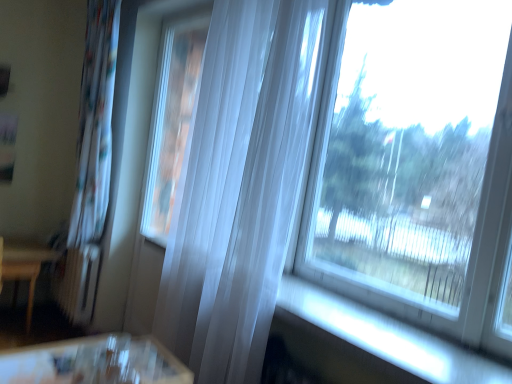
Question: From a real-world perspective, is transparent glass window at upper right positioned over white sheer curtain at left, the 2th curtain positioned from the right, based on gravity?

Choices:
 (A) no
 (B) yes

Answer: (B)

Question: Does transparent glass window at upper right have a lesser width compared to white sheer curtain at left, placed as the first curtain when sorted from left to right?

Choices:
 (A) no
 (B) yes

Answer: (B)

Question: Is white sheer curtain at left, the first curtain in the back-to-front sequence, at the back of transparent glass window at upper right?

Choices:
 (A) yes
 (B) no

Answer: (B)

Question: Does transparent glass window at upper right turn towards white sheer curtain at left, the 2th curtain positioned from the right?

Choices:
 (A) yes
 (B) no

Answer: (B)

Question: Can you confirm if transparent glass window at upper right is shorter than white sheer curtain at left, the 2th curtain positioned from the right?

Choices:
 (A) no
 (B) yes

Answer: (B)

Question: Based on their positions, is white sheer curtain at left, which is the 2th curtain in front-to-back order, located to the left or right of translucent white curtain at center, the first curtain viewed from the right?

Choices:
 (A) right
 (B) left

Answer: (B)

Question: In terms of height, does white sheer curtain at left, which is the 2th curtain in front-to-back order, look taller or shorter compared to translucent white curtain at center, the first curtain viewed from the right?

Choices:
 (A) tall
 (B) short

Answer: (A)

Question: Looking at their shapes, would you say white sheer curtain at left, the 2th curtain positioned from the right, is wider or thinner than translucent white curtain at center, which appears as the second curtain when viewed from the back?

Choices:
 (A) wide
 (B) thin

Answer: (A)

Question: From a real-world perspective, is white sheer curtain at left, the first curtain in the back-to-front sequence, physically located above or below translucent white curtain at center, the first curtain viewed from the right?

Choices:
 (A) below
 (B) above

Answer: (A)

Question: Is wooden table at left taller or shorter than translucent white curtain at center, acting as the 2th curtain starting from the left?

Choices:
 (A) short
 (B) tall

Answer: (A)

Question: In the image, is wooden table at left positioned in front of or behind translucent white curtain at center, which appears as the second curtain when viewed from the back?

Choices:
 (A) front
 (B) behind

Answer: (B)

Question: From a real-world perspective, relative to translucent white curtain at center, the 1th curtain positioned from the front, is wooden table at left vertically above or below?

Choices:
 (A) above
 (B) below

Answer: (B)

Question: Do you think wooden table at left is within translucent white curtain at center, the 1th curtain positioned from the front, or outside of it?

Choices:
 (A) inside
 (B) outside

Answer: (B)

Question: In the image, is translucent white curtain at center, acting as the 2th curtain starting from the left, positioned in front of or behind transparent glass window at upper right?

Choices:
 (A) front
 (B) behind

Answer: (B)

Question: Is point (232, 230) positioned closer to the camera than point (352, 130)?

Choices:
 (A) farther
 (B) closer

Answer: (B)